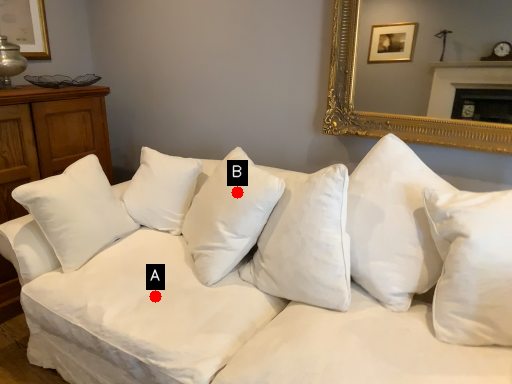
Question: Two points are circled on the image, labeled by A and B beside each circle. Which point is closer to the camera taking this photo?

Choices:
 (A) A is closer
 (B) B is closer

Answer: (A)